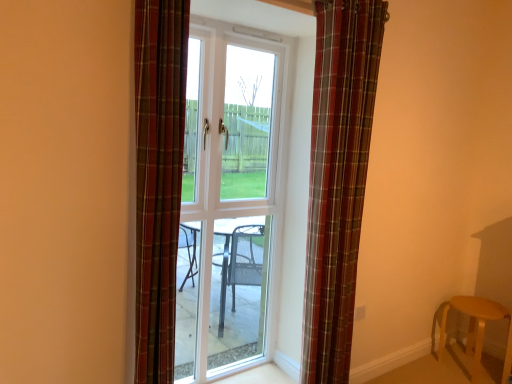
What are the coordinates of `plaid fabric curtain at center, the second curtain in the front-to-back sequence` in the screenshot? It's located at (338, 178).

This screenshot has height=384, width=512. In order to click on plaid fabric curtain at center, marked as the 2th curtain in a back-to-front arrangement in this screenshot , I will do point(158,179).

Image resolution: width=512 pixels, height=384 pixels. What are the coordinates of `plaid fabric curtain at center, positioned as the second curtain in left-to-right order` in the screenshot? It's located at (338, 178).

From the image's perspective, between plaid fabric curtain at center, positioned as the 1th curtain in back-to-front order, and plaid fabric curtain at center, which appears as the 1th curtain when viewed from the front, which one is located above?

From the image's view, plaid fabric curtain at center, which appears as the 1th curtain when viewed from the front, is above.

How much distance is there between plaid fabric curtain at center, positioned as the second curtain in left-to-right order, and plaid fabric curtain at center, the 1th curtain from the left?

plaid fabric curtain at center, positioned as the second curtain in left-to-right order, and plaid fabric curtain at center, the 1th curtain from the left, are 32.81 inches apart from each other.

Can you confirm if plaid fabric curtain at center, positioned as the second curtain in left-to-right order, is positioned to the right of plaid fabric curtain at center, marked as the 2th curtain in a back-to-front arrangement?

Yes, plaid fabric curtain at center, positioned as the second curtain in left-to-right order, is to the right of plaid fabric curtain at center, marked as the 2th curtain in a back-to-front arrangement.

Is plaid fabric curtain at center, which appears as the first curtain when viewed from the right, oriented towards plaid fabric curtain at center, the 2th curtain when ordered from right to left?

No.

Who is smaller, white glass door at center or plaid fabric curtain at center, marked as the 2th curtain in a back-to-front arrangement?

plaid fabric curtain at center, marked as the 2th curtain in a back-to-front arrangement, is smaller.

How much distance is there between white glass door at center and plaid fabric curtain at center, marked as the 2th curtain in a back-to-front arrangement?

white glass door at center is 1.10 meters from plaid fabric curtain at center, marked as the 2th curtain in a back-to-front arrangement.

From the image's perspective, which object appears higher, white glass door at center or plaid fabric curtain at center, the 1th curtain from the left?

From the image's view, plaid fabric curtain at center, the 1th curtain from the left, is above.

Which is in front, point (325, 359) or point (254, 201)?

Point (325, 359)

Which object is positioned more to the right, plaid fabric curtain at center, positioned as the second curtain in left-to-right order, or white glass door at center?

plaid fabric curtain at center, positioned as the second curtain in left-to-right order.

Would you say plaid fabric curtain at center, positioned as the second curtain in left-to-right order, is inside or outside white glass door at center?

The correct answer is: outside.

Is plaid fabric curtain at center, positioned as the second curtain in left-to-right order, positioned in front of white glass door at center?

Yes.

Can you tell me how much white glass door at center and wooden stool at lower right differ in facing direction?

The angular difference between white glass door at center and wooden stool at lower right is 87.8 degrees.

Which object is positioned more to the left, white glass door at center or wooden stool at lower right?

Positioned to the left is white glass door at center.

Is the surface of white glass door at center in direct contact with wooden stool at lower right?

No, white glass door at center is not with wooden stool at lower right.

In the scene shown: From the image's perspective, which one is positioned lower, white glass door at center or wooden stool at lower right?

wooden stool at lower right, from the image's perspective.

Considering their positions, is wooden stool at lower right located in front of or behind white glass door at center?

wooden stool at lower right is behind white glass door at center.

From the image's perspective, is wooden stool at lower right on white glass door at center?

No.

Which object is positioned more to the left, wooden stool at lower right or white glass door at center?

white glass door at center.

Is point (464, 302) closer or farther from the camera than point (228, 210)?

Clearly, point (464, 302) is more distant from the camera than point (228, 210).

Is plaid fabric curtain at center, marked as the 2th curtain in a back-to-front arrangement, in front of or behind plaid fabric curtain at center, positioned as the 1th curtain in back-to-front order, in the image?

Clearly, plaid fabric curtain at center, marked as the 2th curtain in a back-to-front arrangement, is in front of plaid fabric curtain at center, positioned as the 1th curtain in back-to-front order.

Considering the relative sizes of plaid fabric curtain at center, the 2th curtain when ordered from right to left, and plaid fabric curtain at center, positioned as the 1th curtain in back-to-front order, in the image provided, is plaid fabric curtain at center, the 2th curtain when ordered from right to left, thinner than plaid fabric curtain at center, positioned as the 1th curtain in back-to-front order,?

Yes, plaid fabric curtain at center, the 2th curtain when ordered from right to left, is thinner than plaid fabric curtain at center, positioned as the 1th curtain in back-to-front order.

Which is less distant, (169, 57) or (311, 170)?

Answer: Point (169, 57).

Is plaid fabric curtain at center, the 1th curtain from the left, completely or partially outside of wooden stool at lower right?

plaid fabric curtain at center, the 1th curtain from the left, is positioned outside wooden stool at lower right.

Find the location of a particular element. The height and width of the screenshot is (384, 512). curtain that is the 2nd object to the left of the wooden stool at lower right, starting at the anchor is located at coordinates (158, 179).

Measure the distance between plaid fabric curtain at center, marked as the 2th curtain in a back-to-front arrangement, and wooden stool at lower right.

The distance of plaid fabric curtain at center, marked as the 2th curtain in a back-to-front arrangement, from wooden stool at lower right is 7.27 feet.

Consider the image. Considering the sizes of plaid fabric curtain at center, marked as the 2th curtain in a back-to-front arrangement, and wooden stool at lower right in the image, is plaid fabric curtain at center, marked as the 2th curtain in a back-to-front arrangement, taller or shorter than wooden stool at lower right?

Considering their sizes, plaid fabric curtain at center, marked as the 2th curtain in a back-to-front arrangement, has more height than wooden stool at lower right.

Locate an element on the screen. Image resolution: width=512 pixels, height=384 pixels. curtain located underneath the plaid fabric curtain at center, marked as the 2th curtain in a back-to-front arrangement (from a real-world perspective) is located at coordinates (338, 178).

Image resolution: width=512 pixels, height=384 pixels. I want to click on the 2nd curtain above the white glass door at center (from the image's perspective), so tap(158, 179).

Which object lies further to the anchor point plaid fabric curtain at center, which appears as the first curtain when viewed from the right, plaid fabric curtain at center, the 2th curtain when ordered from right to left, or white glass door at center?

plaid fabric curtain at center, the 2th curtain when ordered from right to left, lies further to plaid fabric curtain at center, which appears as the first curtain when viewed from the right, than the other object.

Estimate the real-world distances between objects in this image. Which object is further from white glass door at center, plaid fabric curtain at center, which appears as the 1th curtain when viewed from the front, or plaid fabric curtain at center, positioned as the second curtain in left-to-right order?

Among the two, plaid fabric curtain at center, which appears as the 1th curtain when viewed from the front, is located further to white glass door at center.

Based on their spatial positions, is plaid fabric curtain at center, which appears as the first curtain when viewed from the right, or plaid fabric curtain at center, the 2th curtain when ordered from right to left, closer to white glass door at center?

Based on the image, plaid fabric curtain at center, which appears as the first curtain when viewed from the right, appears to be nearer to white glass door at center.

Considering their positions, is white glass door at center positioned closer to plaid fabric curtain at center, which appears as the 1th curtain when viewed from the front, than wooden stool at lower right?

white glass door at center is positioned closer to the anchor plaid fabric curtain at center, which appears as the 1th curtain when viewed from the front.

When comparing their distances from plaid fabric curtain at center, the 2th curtain when ordered from right to left, does plaid fabric curtain at center, which appears as the first curtain when viewed from the right, or white glass door at center seem closer?

Among the two, plaid fabric curtain at center, which appears as the first curtain when viewed from the right, is located nearer to plaid fabric curtain at center, the 2th curtain when ordered from right to left.

Based on their spatial positions, is wooden stool at lower right or plaid fabric curtain at center, which appears as the 1th curtain when viewed from the front, further from white glass door at center?

wooden stool at lower right is positioned further to the anchor white glass door at center.

Estimate the real-world distances between objects in this image. Which object is further from plaid fabric curtain at center, the second curtain in the front-to-back sequence, white glass door at center or wooden stool at lower right?

wooden stool at lower right is positioned further to the anchor plaid fabric curtain at center, the second curtain in the front-to-back sequence.

When comparing their distances from plaid fabric curtain at center, which appears as the first curtain when viewed from the right, does wooden stool at lower right or plaid fabric curtain at center, the 2th curtain when ordered from right to left, seem further?

The object further to plaid fabric curtain at center, which appears as the first curtain when viewed from the right, is wooden stool at lower right.

You are a GUI agent. You are given a task and a screenshot of the screen. Output one action in this format:
    pyautogui.click(x=<x>, y=<y>)
    Task: Click on the curtain situated between white glass door at center and wooden stool at lower right from left to right
    
    Given the screenshot: What is the action you would take?
    pyautogui.click(x=338, y=178)

Where is `curtain between plaid fabric curtain at center, the 2th curtain when ordered from right to left, and wooden stool at lower right from left to right`? Image resolution: width=512 pixels, height=384 pixels. curtain between plaid fabric curtain at center, the 2th curtain when ordered from right to left, and wooden stool at lower right from left to right is located at coordinates (338, 178).

Where is `bay window between plaid fabric curtain at center, the 2th curtain when ordered from right to left, and plaid fabric curtain at center, which appears as the first curtain when viewed from the right`? This screenshot has height=384, width=512. bay window between plaid fabric curtain at center, the 2th curtain when ordered from right to left, and plaid fabric curtain at center, which appears as the first curtain when viewed from the right is located at coordinates (231, 198).

Identify the location of bay window between plaid fabric curtain at center, marked as the 2th curtain in a back-to-front arrangement, and wooden stool at lower right, in the horizontal direction. This screenshot has height=384, width=512. (231, 198).